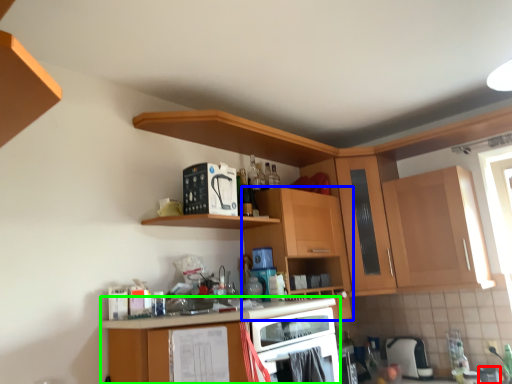
Question: Based on their relative distances, which object is farther from appliance (highlighted by a red box)? Choose from cabinetry (highlighted by a blue box) and cabinetry (highlighted by a green box).

Choices:
 (A) cabinetry
 (B) cabinetry

Answer: (B)